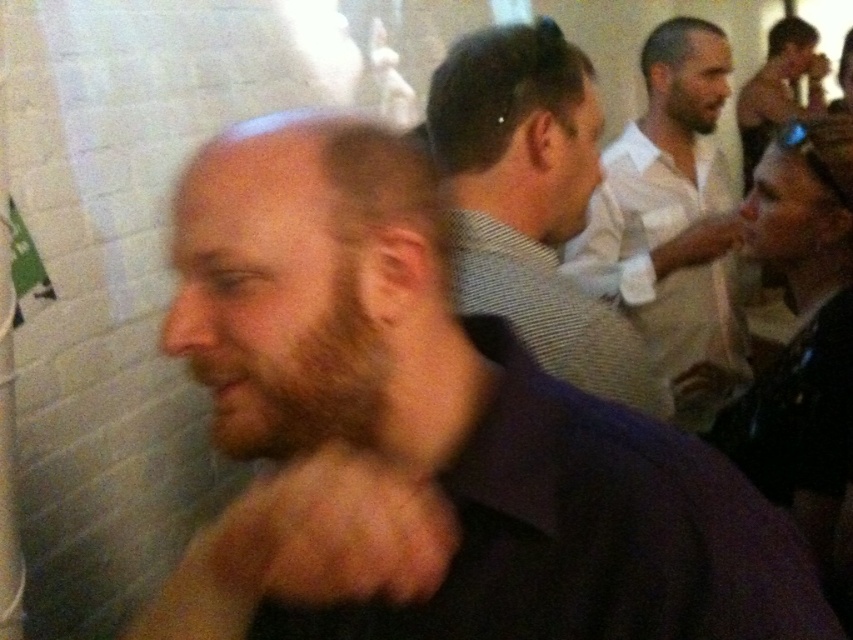
Does checkered shirt at center appear on the left side of white shirt at center?

Indeed, checkered shirt at center is positioned on the left side of white shirt at center.

Is checkered shirt at center further to the viewer compared to white shirt at center?

No, checkered shirt at center is in front of white shirt at center.

Identify the location of checkered shirt at center. This screenshot has height=640, width=853. (531, 202).

Image resolution: width=853 pixels, height=640 pixels. I want to click on checkered shirt at center, so click(x=531, y=202).

Does checkered shirt at center appear over shiny silver phone at upper right?

Actually, checkered shirt at center is below shiny silver phone at upper right.

Does point (578, 140) lie in front of point (764, 84)?

Yes.

Describe the element at coordinates (531, 202) in the screenshot. The width and height of the screenshot is (853, 640). I see `checkered shirt at center` at that location.

You are a GUI agent. You are given a task and a screenshot of the screen. Output one action in this format:
    pyautogui.click(x=<x>, y=<y>)
    Task: Click on the checkered shirt at center
    The height and width of the screenshot is (640, 853).
    Given the screenshot: What is the action you would take?
    pyautogui.click(x=531, y=202)

Which is more to the right, brown beard at center or checkered shirt at center?

From the viewer's perspective, checkered shirt at center appears more on the right side.

Is brown beard at center below checkered shirt at center?

Correct, brown beard at center is located below checkered shirt at center.

Who is more distant from viewer, (302, 163) or (548, 317)?

The point (548, 317) is behind.

The height and width of the screenshot is (640, 853). I want to click on brown beard at center, so click(x=426, y=435).